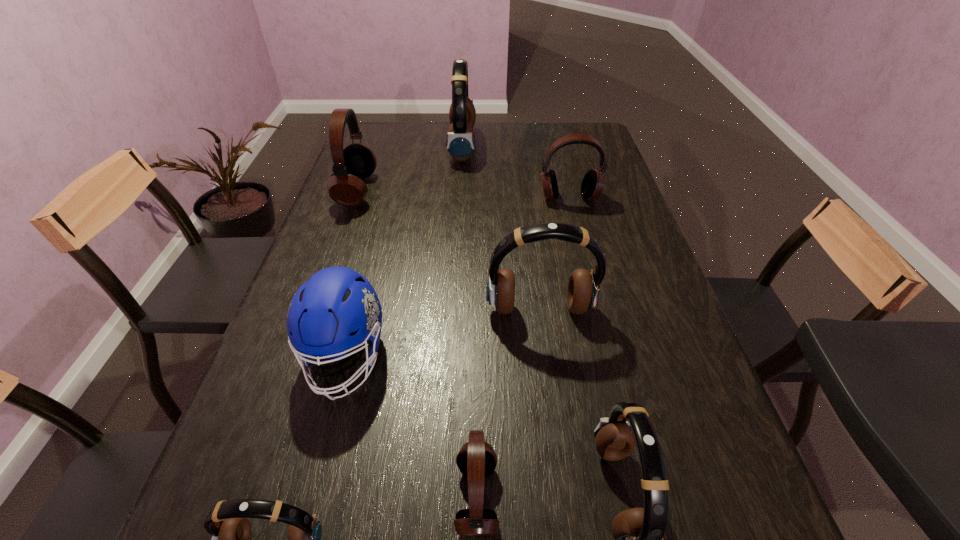
I want to click on blank region between the farthest headset and the blue football helmet, so click(404, 252).

Where is `object that is the closest to the farthest object`? This screenshot has width=960, height=540. object that is the closest to the farthest object is located at coordinates (355, 162).

Locate an element on the screen. The width and height of the screenshot is (960, 540). object that can be found as the sixth closest to the blue football helmet is located at coordinates (592, 185).

Image resolution: width=960 pixels, height=540 pixels. Identify the location of headset that is the closest to the third nearest brown headset. (638, 532).

Point out which headset is positioned as the second nearest to the smallest black headset. Please provide its 2D coordinates. Your answer should be formatted as a tuple, i.e. [(x, y)], where the tuple contains the x and y coordinates of a point satisfying the conditions above.

[(227, 521)]

The height and width of the screenshot is (540, 960). Identify the location of brown headset that is the fourth closest one to the second black headset from right to left. (460, 140).

At what (x,y) coordinates should I click in order to perform the action: click on brown headset that is the second nearest to the nearest black headset. Please return your answer as a coordinate pair (x, y). Image resolution: width=960 pixels, height=540 pixels. Looking at the image, I should click on (227, 521).

I want to click on the closest black headset to the football helmet, so click(476, 459).

Point out which black headset is positioned as the nearest to the blue football helmet. Please provide its 2D coordinates. Your answer should be formatted as a tuple, i.e. [(x, y)], where the tuple contains the x and y coordinates of a point satisfying the conditions above.

[(476, 459)]

You are a GUI agent. You are given a task and a screenshot of the screen. Output one action in this format:
    pyautogui.click(x=<x>, y=<y>)
    Task: Click on the vacant point that satisfies the following two spatial constraints: 1. on the ear cup of the farthest headset; 2. on the face guard of the football helmet
    The height and width of the screenshot is (540, 960).
    Given the screenshot: What is the action you would take?
    (x=449, y=357)